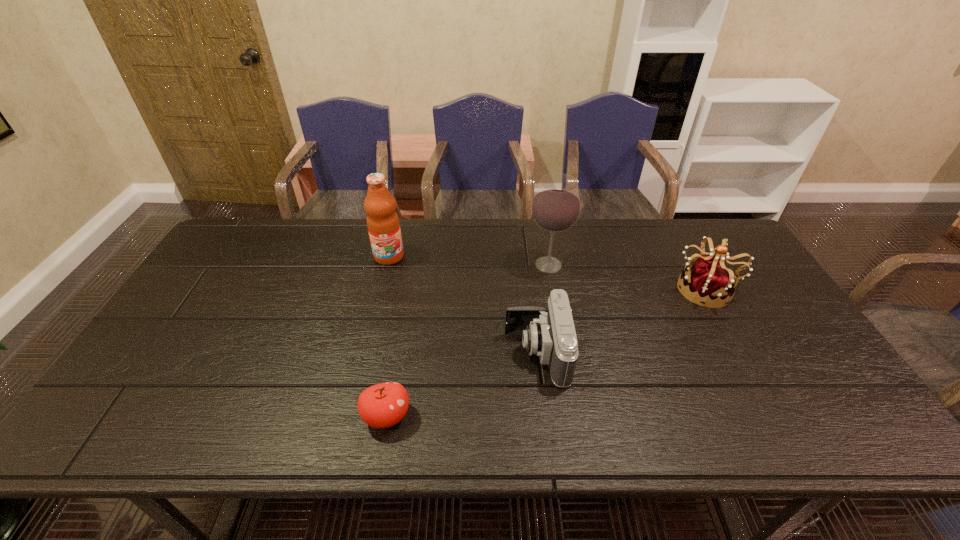
Find the location of a particular element. The width and height of the screenshot is (960, 540). object present at the right edge is located at coordinates (708, 282).

In the image, there is a desktop. Where is `vacant space at the far edge`? This screenshot has width=960, height=540. vacant space at the far edge is located at coordinates (287, 237).

Image resolution: width=960 pixels, height=540 pixels. I want to click on vacant position at the near edge of the desktop, so click(x=401, y=438).

This screenshot has width=960, height=540. In the image, there is a desktop. Find the location of `vacant space at the left edge`. vacant space at the left edge is located at coordinates (215, 281).

This screenshot has height=540, width=960. In order to click on free space at the near left corner of the desktop in this screenshot , I will do `click(132, 441)`.

Image resolution: width=960 pixels, height=540 pixels. What are the coordinates of `free location at the near right corner` in the screenshot? It's located at (811, 426).

You are a GUI agent. You are given a task and a screenshot of the screen. Output one action in this format:
    pyautogui.click(x=<x>, y=<y>)
    Task: Click on the vacant space that's between the fruit juice and the alcohol
    Image resolution: width=960 pixels, height=540 pixels.
    Given the screenshot: What is the action you would take?
    pyautogui.click(x=468, y=261)

Where is `free point between the alcohol and the fruit juice`? Image resolution: width=960 pixels, height=540 pixels. free point between the alcohol and the fruit juice is located at coordinates (468, 261).

You are a GUI agent. You are given a task and a screenshot of the screen. Output one action in this format:
    pyautogui.click(x=<x>, y=<y>)
    Task: Click on the vacant point located between the alcohol and the shortest object
    This screenshot has width=960, height=540.
    Given the screenshot: What is the action you would take?
    pyautogui.click(x=468, y=341)

In order to click on free point between the third shortest object and the alcohol in this screenshot , I will do `click(628, 277)`.